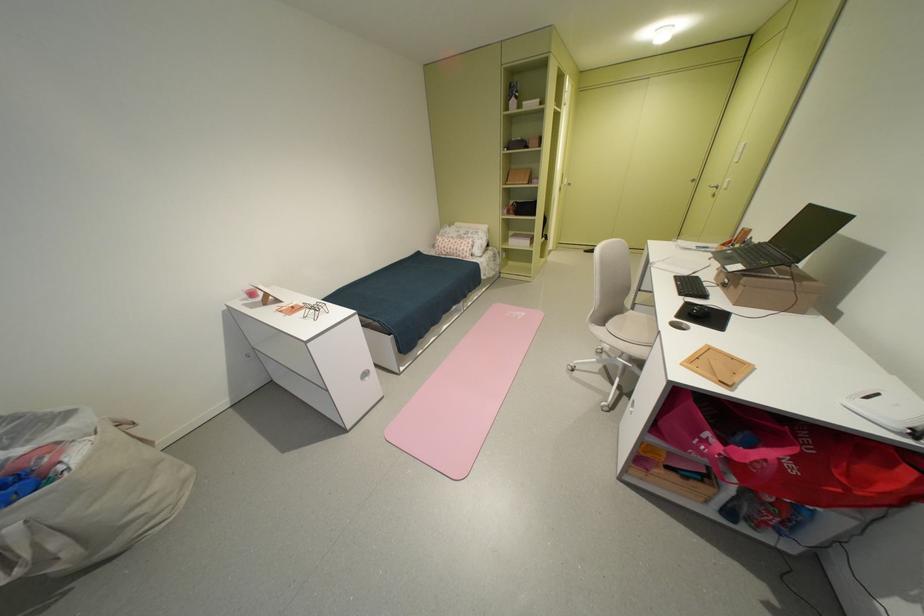
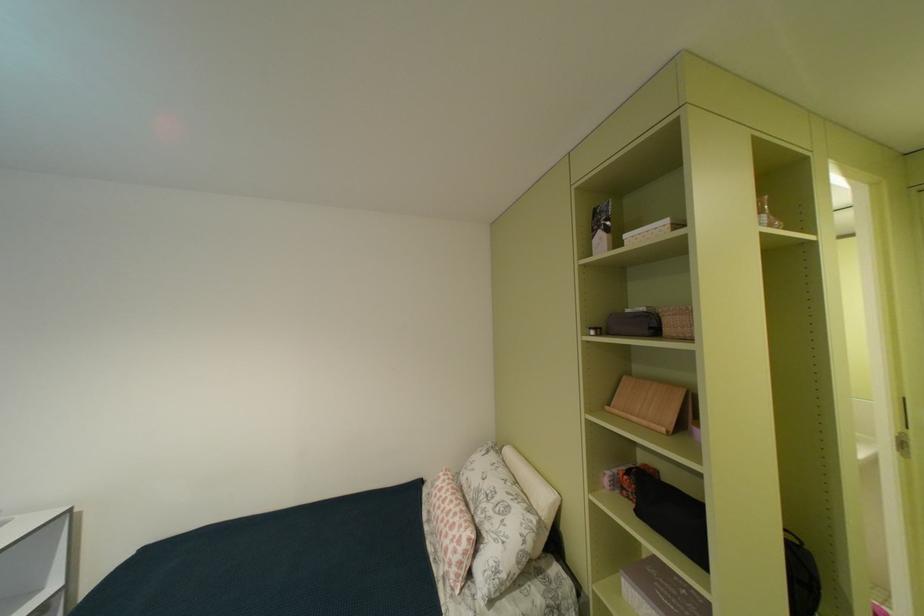
Where in the second image is the point corresponding to pixel 467 236 from the first image?

(487, 487)